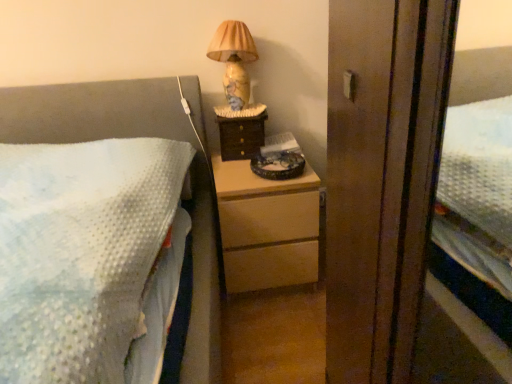
Question: Is marble-patterned lampshade at upper right oriented away from light wood chest of drawers at center?

Choices:
 (A) no
 (B) yes

Answer: (A)

Question: Can you confirm if marble-patterned lampshade at upper right is positioned to the right of light wood chest of drawers at center?

Choices:
 (A) no
 (B) yes

Answer: (A)

Question: Does marble-patterned lampshade at upper right have a greater width compared to light wood chest of drawers at center?

Choices:
 (A) no
 (B) yes

Answer: (A)

Question: Is there a large distance between marble-patterned lampshade at upper right and light wood chest of drawers at center?

Choices:
 (A) no
 (B) yes

Answer: (A)

Question: Can you confirm if marble-patterned lampshade at upper right is shorter than light wood chest of drawers at center?

Choices:
 (A) no
 (B) yes

Answer: (B)

Question: Is marble-patterned lampshade at upper right bigger than light wood chest of drawers at center?

Choices:
 (A) yes
 (B) no

Answer: (B)

Question: From a real-world perspective, is marble-patterned lampshade at upper right on top of wooden drawer at center?

Choices:
 (A) no
 (B) yes

Answer: (B)

Question: Could you tell me if marble-patterned lampshade at upper right is facing wooden drawer at center?

Choices:
 (A) no
 (B) yes

Answer: (A)

Question: From the image's perspective, is marble-patterned lampshade at upper right on wooden drawer at center?

Choices:
 (A) yes
 (B) no

Answer: (A)

Question: Considering the relative positions of marble-patterned lampshade at upper right and wooden drawer at center in the image provided, is marble-patterned lampshade at upper right to the right of wooden drawer at center from the viewer's perspective?

Choices:
 (A) no
 (B) yes

Answer: (A)

Question: Is the depth of marble-patterned lampshade at upper right greater than that of wooden drawer at center?

Choices:
 (A) no
 (B) yes

Answer: (A)

Question: Is marble-patterned lampshade at upper right in contact with wooden drawer at center?

Choices:
 (A) no
 (B) yes

Answer: (A)

Question: Is wooden drawer at center positioned before light wood chest of drawers at center?

Choices:
 (A) no
 (B) yes

Answer: (A)